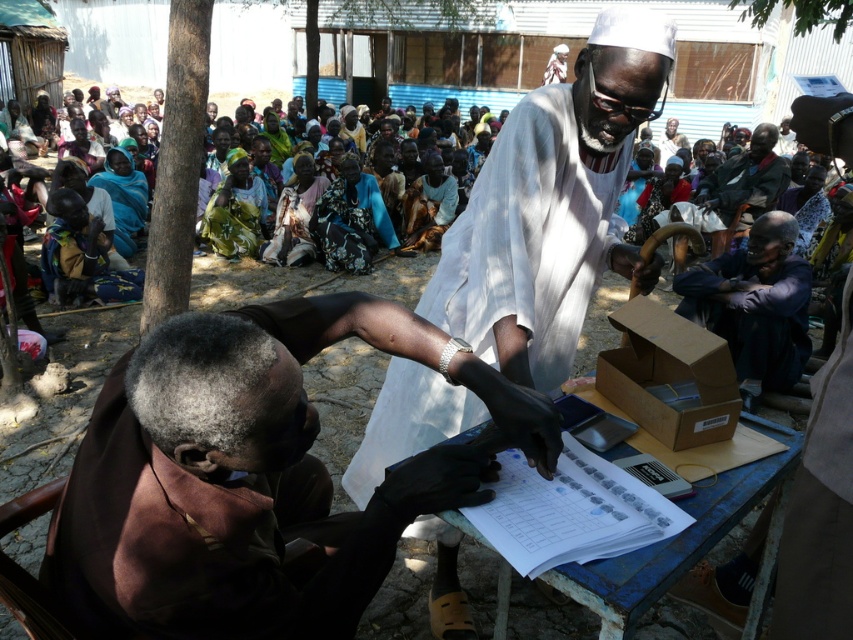
Question: Is purple fabric shirt at lower right above floral print fabric at center?

Choices:
 (A) no
 (B) yes

Answer: (A)

Question: Which object is positioned farthest from the purple fabric shirt at lower right?

Choices:
 (A) brown leather glove at lower left
 (B) white cloth at center
 (C) floral print fabric at center

Answer: (C)

Question: Which of the following is the farthest from the observer?

Choices:
 (A) purple fabric shirt at lower right
 (B) brown leather glove at lower left

Answer: (A)

Question: Can you confirm if brown leather glove at lower left is positioned above purple fabric shirt at lower right?

Choices:
 (A) no
 (B) yes

Answer: (A)

Question: Which point is farther to the camera?

Choices:
 (A) brown leather glove at lower left
 (B) white cloth at center
 (C) floral print fabric at center
 (D) purple fabric shirt at lower right

Answer: (C)

Question: Is brown leather glove at lower left smaller than floral print fabric at center?

Choices:
 (A) no
 (B) yes

Answer: (B)